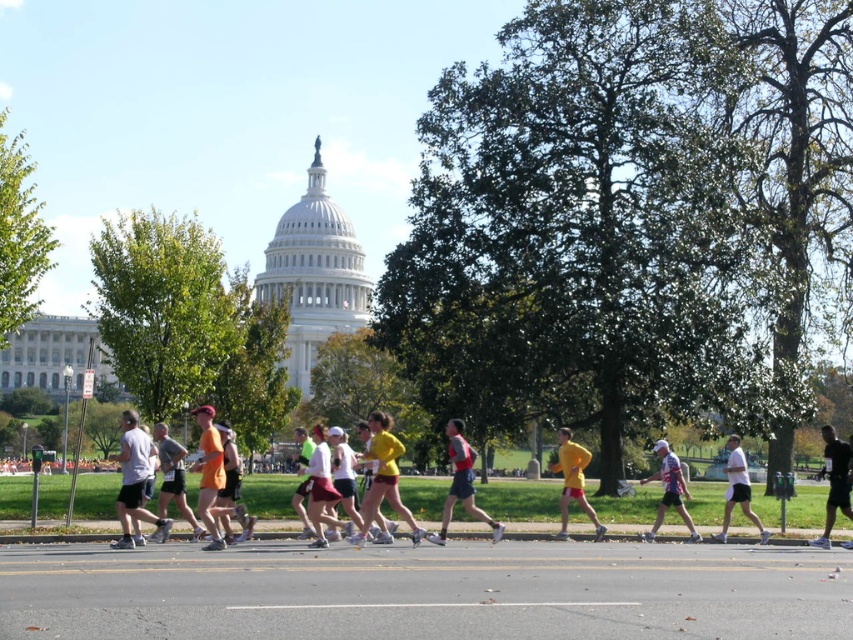
Question: Can you confirm if yellow fabric shorts at center is wider than gray mesh tank top at center?

Choices:
 (A) no
 (B) yes

Answer: (A)

Question: Is gray mesh tank top at center bigger than matte gray shirt at center?

Choices:
 (A) yes
 (B) no

Answer: (A)

Question: Which of these objects is positioned farthest from the black athletic wear at center?

Choices:
 (A) white matte jersey at center
 (B) white matte shorts at center

Answer: (A)

Question: Among these objects, which one is farthest from the camera?

Choices:
 (A) white matte jersey at center
 (B) matte gray shirt at center
 (C) yellow matte shirt at center
 (D) white cotton shirt at center

Answer: (A)

Question: Can you confirm if yellow matte shirt at center is positioned to the left of matte gray shirt at center?

Choices:
 (A) yes
 (B) no

Answer: (B)

Question: Which point appears closest to the camera in this image?

Choices:
 (A) (173, 460)
 (B) (450, 422)
 (C) (824, 436)

Answer: (A)